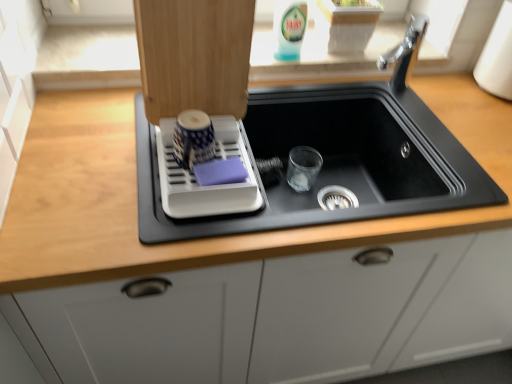
Question: Considering the positions of white plastic dish rack at upper left and translucent plastic bottle at upper center in the image, is white plastic dish rack at upper left taller or shorter than translucent plastic bottle at upper center?

Choices:
 (A) tall
 (B) short

Answer: (B)

Question: From the image's perspective, is white plastic dish rack at upper left positioned above or below translucent plastic bottle at upper center?

Choices:
 (A) below
 (B) above

Answer: (A)

Question: Which of these objects is positioned closest to the translucent plastic bottle at upper center?

Choices:
 (A) black matte sink at center
 (B) white plastic dish rack at upper left

Answer: (A)

Question: Which is nearer to the black matte sink at center?

Choices:
 (A) translucent plastic bottle at upper center
 (B) white plastic dish rack at upper left

Answer: (B)